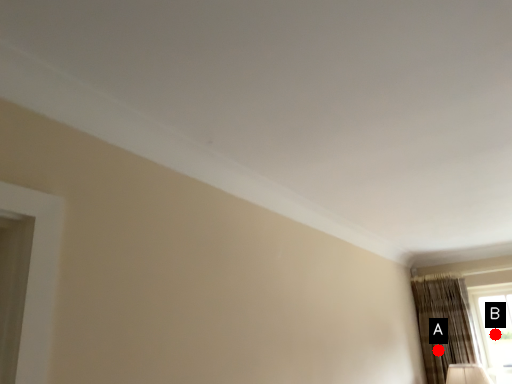
Question: Two points are circled on the image, labeled by A and B beside each circle. Which point is farther from the camera taking this photo?

Choices:
 (A) A is further
 (B) B is further

Answer: (B)